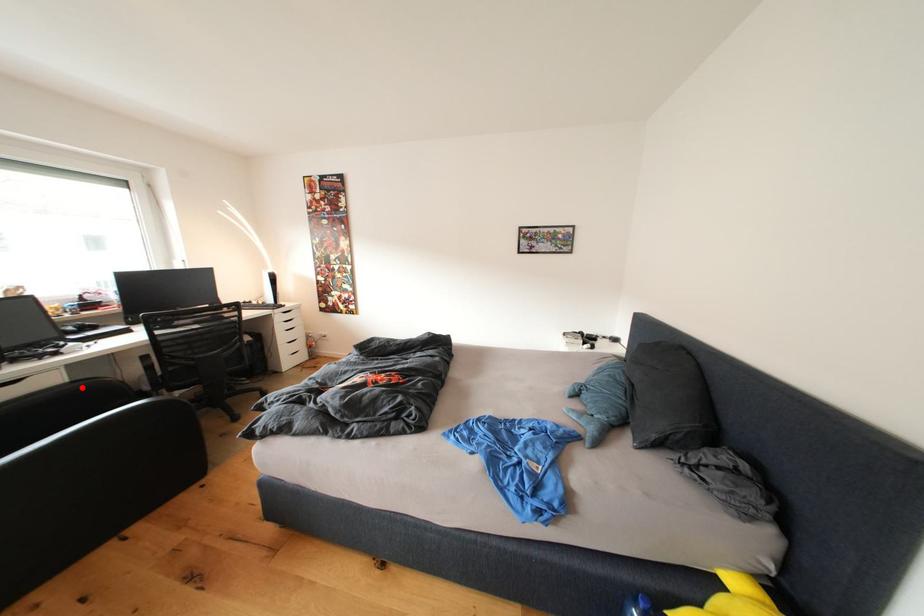
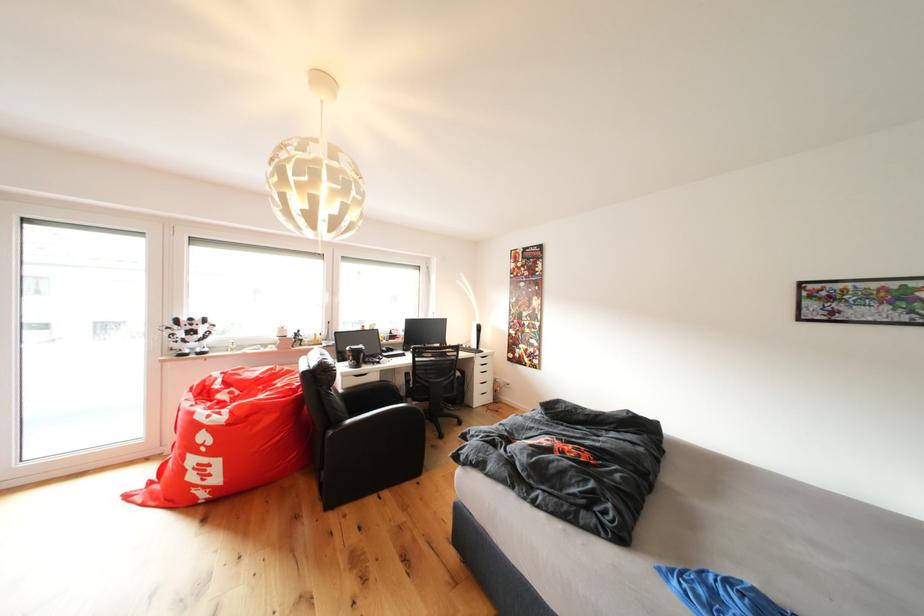
In the second image, find the point that corresponds to the highlighted location in the first image.

(390, 387)